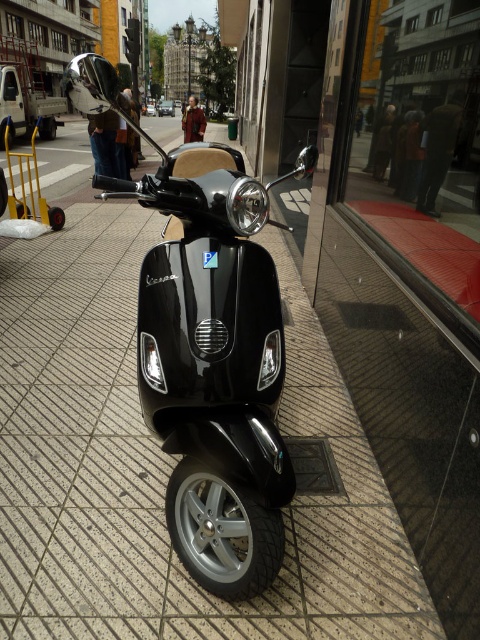
You are a delivery person who needs to move a box from the glossy black scooter at center to the red glass window at center. Given that the box is 3 feet wide, will you be able to carry it between them without tilting it sideways?

The glossy black scooter at center and red glass window at center are 35.45 inches apart. Since 3 feet equals 36 inches, the distance between them is slightly less than the box width. Therefore, you would need to tilt the box sideways to fit through the space.

Looking at this image, you are a delivery person trying to park your scooter between two objects. The glossy black scooter at center and the red glass window at center are in your way. Which object should you move to make space for your scooter?

The glossy black scooter at center is wider than the red glass window at center, so you should move the glossy black scooter at center to make space for your scooter.